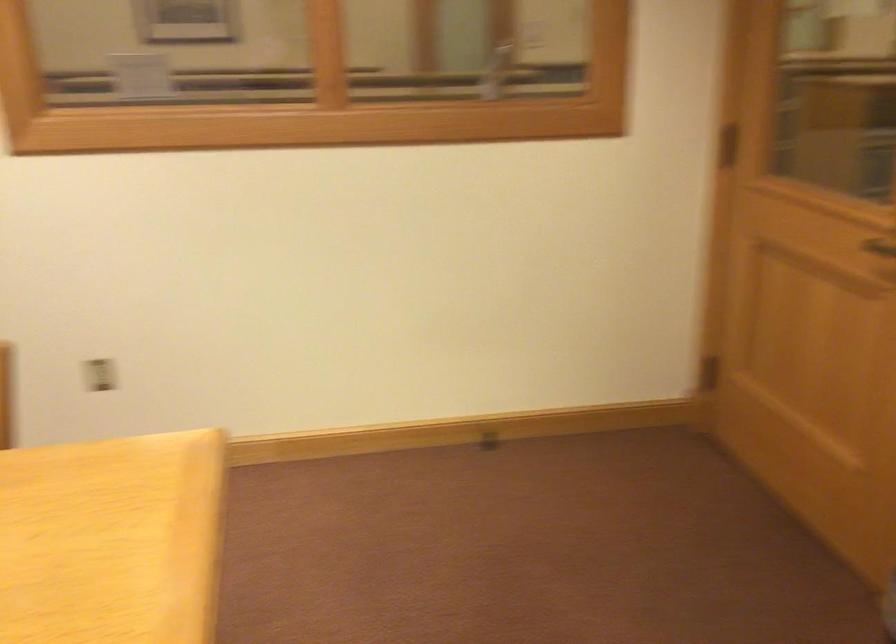
Image resolution: width=896 pixels, height=644 pixels. I want to click on silver window latch, so click(495, 71).